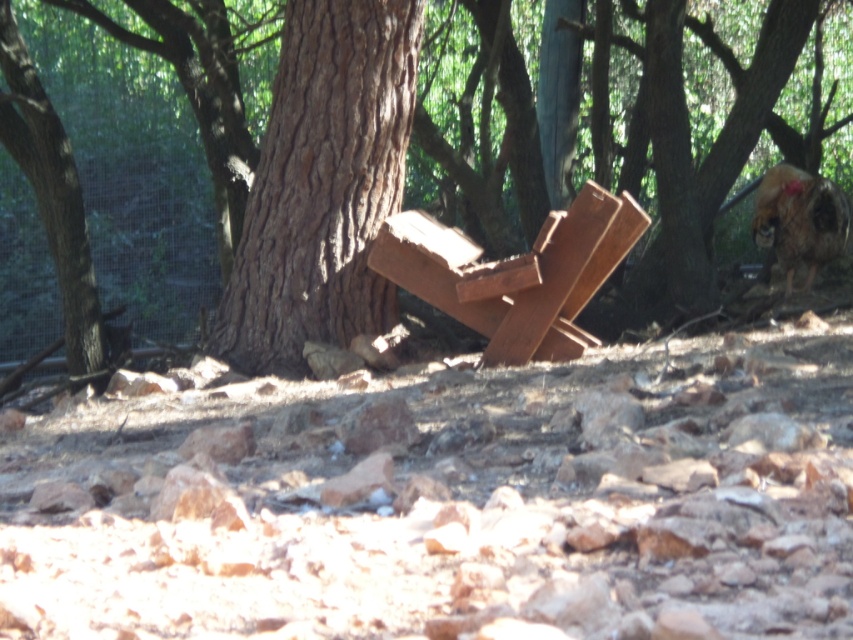
Question: Is brown rough bark tree at center bigger than woodenmaterial/texture at center?

Choices:
 (A) yes
 (B) no

Answer: (A)

Question: Which object is farther from the camera taking this photo?

Choices:
 (A) brown rough bark tree at center
 (B) woodenmaterial/texture at center
 (C) brown rough tree trunk at center

Answer: (A)

Question: Which point is closer to the camera?

Choices:
 (A) (665, 26)
 (B) (556, 324)

Answer: (B)

Question: Can you confirm if brown rough tree trunk at center is wider than brown rough bark tree at center?

Choices:
 (A) no
 (B) yes

Answer: (A)

Question: Which object is positioned farthest from the woodenmaterial/texture at center?

Choices:
 (A) brown rough tree trunk at center
 (B) brown rough bark tree at center

Answer: (B)

Question: Is brown rough tree trunk at center behind brown rough bark tree at center?

Choices:
 (A) yes
 (B) no

Answer: (B)